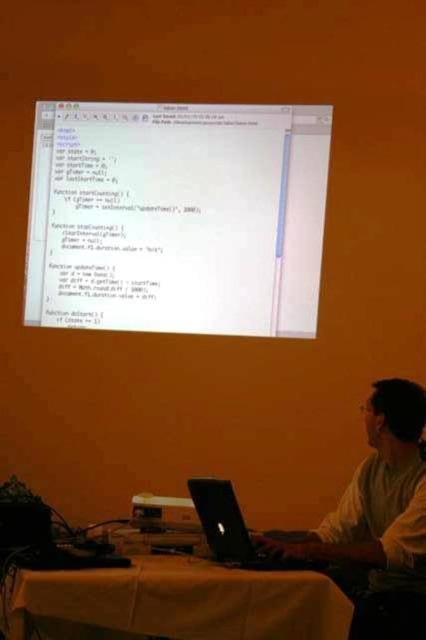
You are standing in front of the table and notice two points marked on the table. The first point is at coordinates point (118, 188) and the second is at point (183, 497). If you were to place a small object on the table, which point would require you to reach further towards the table to place it?

Point (183, 497) is closer to the viewer than point (118, 188), so placing an object there would require reaching further towards the table.

Based on the scene description, which object is taller between the white glossy text at center and the white shirt at center?

The white glossy text at center is much taller than the white shirt at center.